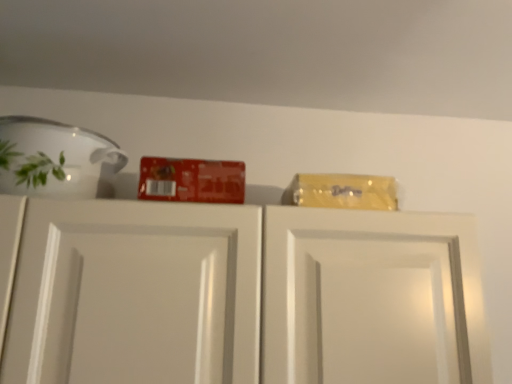
Where is `white glossy cabinet doors at upper center`? This screenshot has width=512, height=384. white glossy cabinet doors at upper center is located at coordinates (246, 295).

The width and height of the screenshot is (512, 384). What do you see at coordinates (246, 295) in the screenshot?
I see `white glossy cabinet doors at upper center` at bounding box center [246, 295].

This screenshot has height=384, width=512. I want to click on white glossy bowl at upper left, so click(x=56, y=159).

The width and height of the screenshot is (512, 384). Describe the element at coordinates (56, 159) in the screenshot. I see `white glossy bowl at upper left` at that location.

In order to face white glossy bowl at upper left, should I rotate leftwards or rightwards?

You should rotate left by 25.458 degrees.

Locate an element on the screen. This screenshot has width=512, height=384. white glossy cabinet doors at upper center is located at coordinates (246, 295).

Between white glossy bowl at upper left and white glossy cabinet doors at upper center, which one appears on the left side from the viewer's perspective?

white glossy bowl at upper left.

Is white glossy bowl at upper left in front of or behind white glossy cabinet doors at upper center in the image?

A: Clearly, white glossy bowl at upper left is behind white glossy cabinet doors at upper center.

Is point (125, 162) positioned in front of point (173, 322)?

That is False.

From the image's perspective, is white glossy bowl at upper left beneath white glossy cabinet doors at upper center?

No, from the image's perspective, white glossy bowl at upper left is not below white glossy cabinet doors at upper center.

From a real-world perspective, is white glossy bowl at upper left above or below white glossy cabinet doors at upper center?

From a real-world perspective, white glossy bowl at upper left is physically above white glossy cabinet doors at upper center.

Between white glossy bowl at upper left and white glossy cabinet doors at upper center, which one has smaller width?

white glossy bowl at upper left.

Considering the sizes of white glossy bowl at upper left and white glossy cabinet doors at upper center in the image, is white glossy bowl at upper left taller or shorter than white glossy cabinet doors at upper center?

Clearly, white glossy bowl at upper left is shorter compared to white glossy cabinet doors at upper center.

Does white glossy bowl at upper left have a smaller size compared to white glossy cabinet doors at upper center?

Yes.

Is white glossy bowl at upper left surrounding white glossy cabinet doors at upper center?

That's incorrect, white glossy cabinet doors at upper center is not inside white glossy bowl at upper left.

Is there a large distance between white glossy bowl at upper left and white glossy cabinet doors at upper center?

white glossy bowl at upper left is near white glossy cabinet doors at upper center, not far away.

Is white glossy bowl at upper left oriented towards white glossy cabinet doors at upper center?

No, white glossy bowl at upper left is not oriented towards white glossy cabinet doors at upper center.

At what (x,y) coordinates should I click in order to perform the action: click on cabinetry in front of the white glossy bowl at upper left. Please return your answer as a coordinate pair (x, y). Looking at the image, I should click on (246, 295).

Does white glossy cabinet doors at upper center appear on the right side of white glossy bowl at upper left?

Indeed, white glossy cabinet doors at upper center is positioned on the right side of white glossy bowl at upper left.

Which object is closer to the camera taking this photo, white glossy cabinet doors at upper center or white glossy bowl at upper left?

white glossy cabinet doors at upper center.

Which point is more distant from viewer, (39, 302) or (56, 190)?

The point (56, 190) is behind.

From the image's perspective, is white glossy cabinet doors at upper center on white glossy bowl at upper left?

No, from the image's perspective, white glossy cabinet doors at upper center is not over white glossy bowl at upper left.

From a real-world perspective, which object rests below the other?

white glossy cabinet doors at upper center is physically lower.

Which object is wider, white glossy cabinet doors at upper center or white glossy bowl at upper left?

white glossy cabinet doors at upper center.

Can you confirm if white glossy cabinet doors at upper center is taller than white glossy bowl at upper left?

Yes.

Based on their sizes in the image, would you say white glossy cabinet doors at upper center is bigger or smaller than white glossy bowl at upper left?

Clearly, white glossy cabinet doors at upper center is larger in size than white glossy bowl at upper left.

Is white glossy cabinet doors at upper center not inside white glossy bowl at upper left?

Yes, white glossy cabinet doors at upper center is outside of white glossy bowl at upper left.

Does white glossy cabinet doors at upper center touch white glossy bowl at upper left?

No, white glossy cabinet doors at upper center is not next to white glossy bowl at upper left.

Is white glossy bowl at upper left at the back of white glossy cabinet doors at upper center?

white glossy cabinet doors at upper center does not have its back to white glossy bowl at upper left.

What's the angular difference between white glossy cabinet doors at upper center and white glossy bowl at upper left's facing directions?

The angular difference between white glossy cabinet doors at upper center and white glossy bowl at upper left is 0.643 degrees.

Where is `tableware on the left of white glossy cabinet doors at upper center`? tableware on the left of white glossy cabinet doors at upper center is located at coordinates (56, 159).

Where is `tableware behind the white glossy cabinet doors at upper center`? This screenshot has width=512, height=384. tableware behind the white glossy cabinet doors at upper center is located at coordinates (56, 159).

Where is `cabinetry that is below the white glossy bowl at upper left (from the image's perspective)`? This screenshot has height=384, width=512. cabinetry that is below the white glossy bowl at upper left (from the image's perspective) is located at coordinates (246, 295).